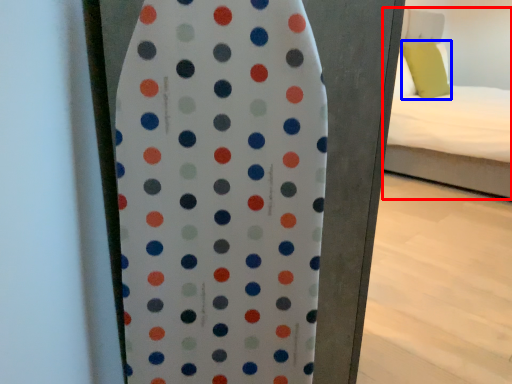
Question: Which point is closer to the camera, bed (highlighted by a red box) or pillow (highlighted by a blue box)?

Choices:
 (A) bed
 (B) pillow

Answer: (A)